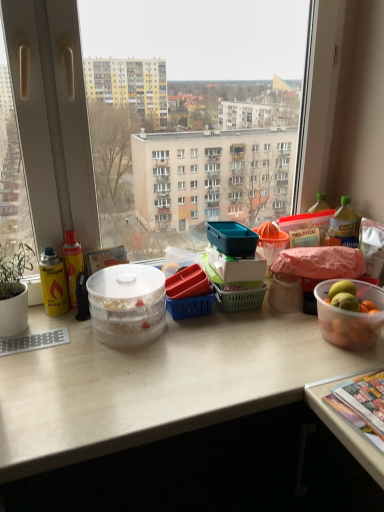
Image resolution: width=384 pixels, height=512 pixels. Identify the location of vacant space that's between transparent plastic bowl at center, the second bowl from the right, and translucent plastic bowl at right, acting as the 2th bowl starting from the left. (238, 337).